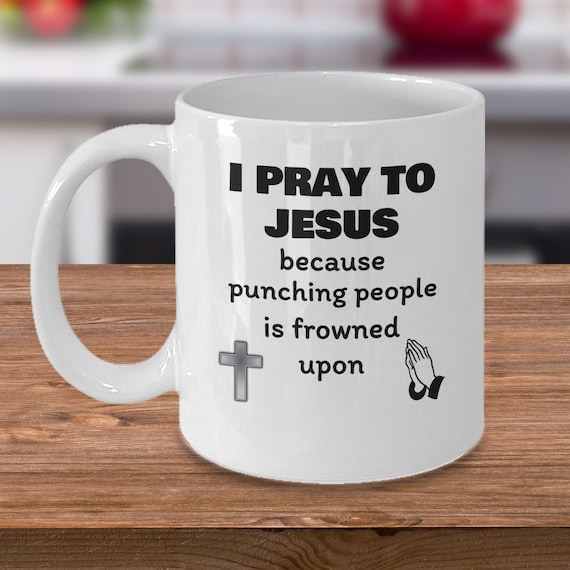
At what (x,y) coordinates should I click in order to perform the action: click on red circle on white countertop, top left. Please return your answer as a coordinate pair (x, y). Looking at the image, I should click on (44, 21).